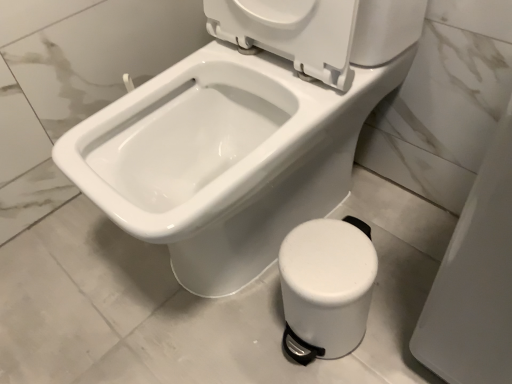
Where is `unoccupied region to the right of white plastic pedal bin at lower right`? Image resolution: width=512 pixels, height=384 pixels. unoccupied region to the right of white plastic pedal bin at lower right is located at coordinates (393, 305).